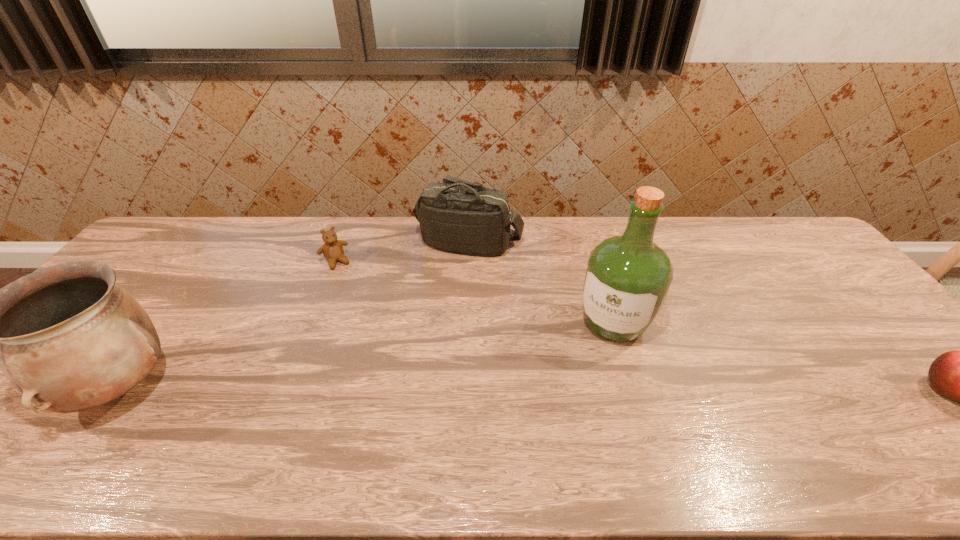
Image resolution: width=960 pixels, height=540 pixels. Identify the location of urn. (69, 338).

Find the location of `teddy bear`. teddy bear is located at coordinates (332, 249).

Where is `the third shortest object`? The height and width of the screenshot is (540, 960). the third shortest object is located at coordinates (458, 216).

Where is `shoulder bag`? The height and width of the screenshot is (540, 960). shoulder bag is located at coordinates (458, 216).

At what (x,y) coordinates should I click in order to perform the action: click on the second object from right to left. Please return your answer as a coordinate pair (x, y). The height and width of the screenshot is (540, 960). Looking at the image, I should click on (627, 278).

Identify the location of the tallest object. This screenshot has width=960, height=540. (627, 278).

Locate an element on the screen. free space located 0.340m on the back of the leftmost object is located at coordinates (212, 260).

The image size is (960, 540). What are the coordinates of `vacant space located 0.230m on the front-facing side of the fourth object from right to left` in the screenshot? It's located at (368, 314).

The width and height of the screenshot is (960, 540). I want to click on free spot located 0.190m on the front-facing side of the fourth object from right to left, so click(363, 306).

Locate an element on the screen. The width and height of the screenshot is (960, 540). vacant space located on the front-facing side of the fourth object from right to left is located at coordinates (364, 307).